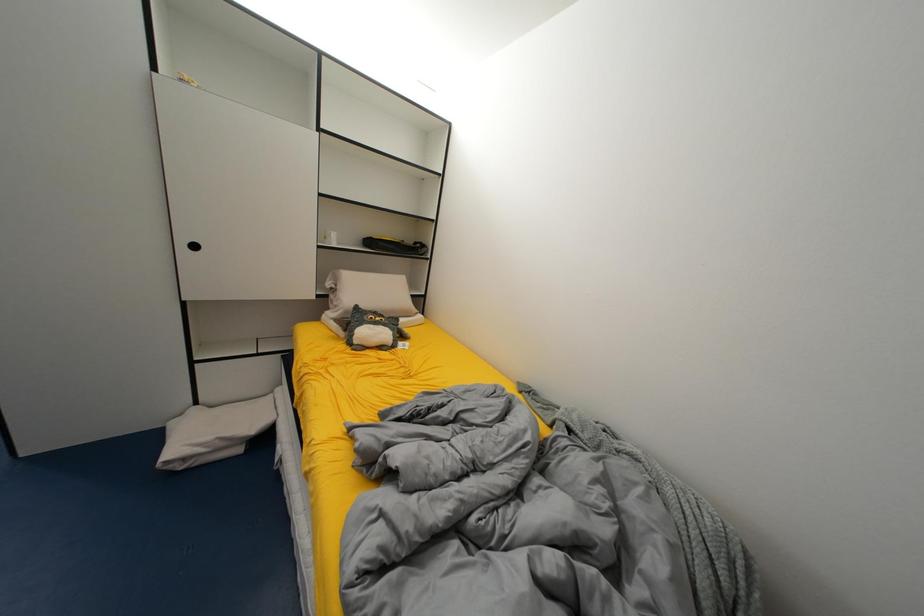
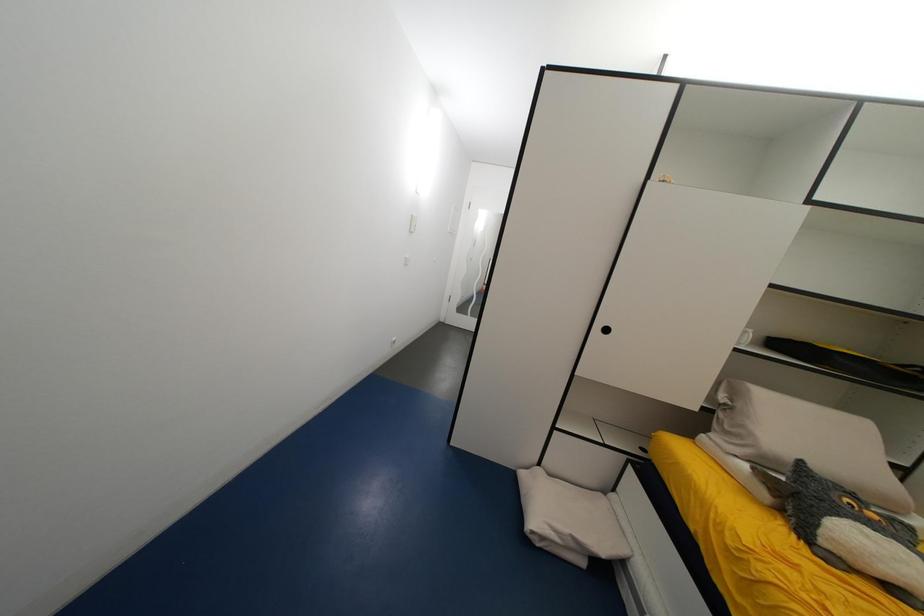
Question: How did the camera likely rotate?

Choices:
 (A) Left
 (B) Right
 (C) Up
 (D) Down

Answer: (A)